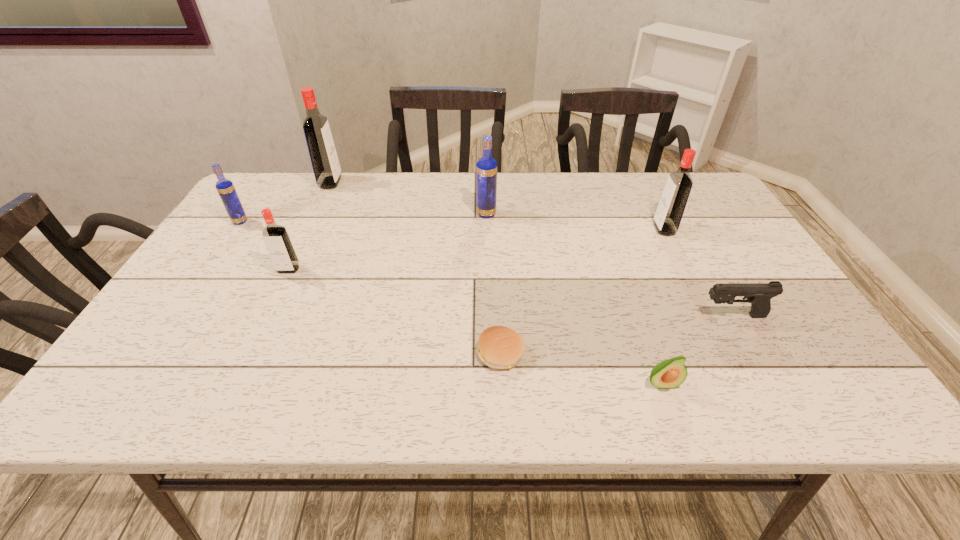
Locate an element on the screen. The width and height of the screenshot is (960, 540). pistol is located at coordinates (759, 295).

You are a GUI agent. You are given a task and a screenshot of the screen. Output one action in this format:
    pyautogui.click(x=<x>, y=<y>)
    Task: Click on the nearest object
    This screenshot has width=960, height=540.
    Given the screenshot: What is the action you would take?
    [667, 374]

Locate an element on the screen. the sixth object from left to right is located at coordinates (667, 374).

Where is `patty`? This screenshot has width=960, height=540. patty is located at coordinates (499, 347).

This screenshot has height=540, width=960. What are the coordinates of `the shortest object` in the screenshot? It's located at (499, 347).

This screenshot has height=540, width=960. I want to click on vacant region located on the front and back of the tallest object, so click(430, 183).

What are the coordinates of `free point located 0.200m on the right of the bigger blue vodka` in the screenshot? It's located at (564, 214).

Where is `free region located on the front and back of the second nearest red vodka`? The height and width of the screenshot is (540, 960). free region located on the front and back of the second nearest red vodka is located at coordinates (595, 229).

This screenshot has height=540, width=960. In order to click on vacant area situated on the front and back of the second nearest red vodka in this screenshot , I will do `click(566, 229)`.

Find the location of `vacant space located on the front and back of the second nearest red vodka`. vacant space located on the front and back of the second nearest red vodka is located at coordinates (581, 229).